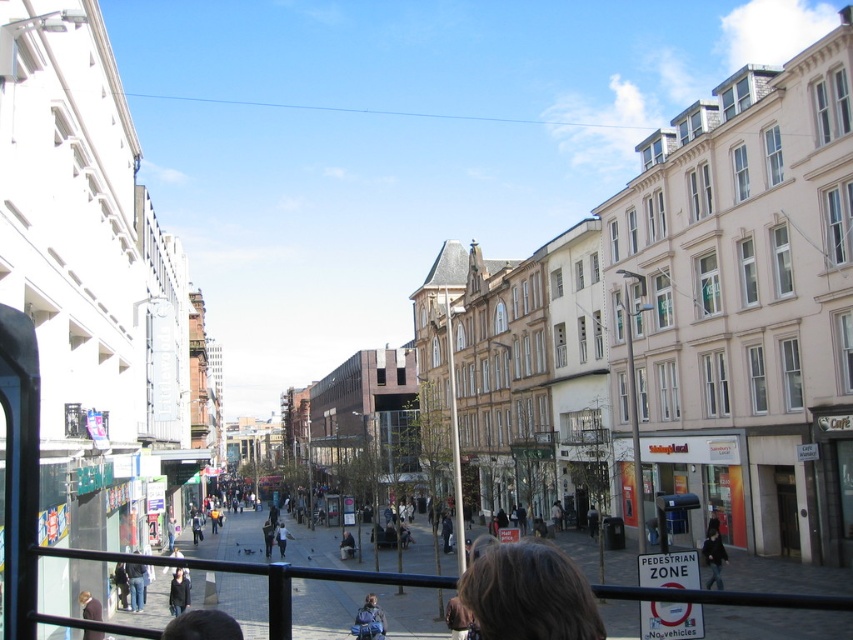
You are standing at the center of the bustling urban street scene. You see a dark brown hair at lower center located at point (527, 593). Is there any object at that point?

Yes, at point (527, 593) lies dark brown hair at lower center.

You are standing at the Pedestrian Zone sign and want to reach a destination located at point [171,582]. There is an obstacle at point [560,609]. Which point should you avoid to reach your destination safely?

You should avoid point [560,609] because it is in front of point [171,582], meaning it blocks the path to your destination.

You are standing at the camera position and want to take a photo of the dark brown hair at lower center. Considering the camera has a maximum focus range of 30 meters, will you be able to capture it clearly?

The dark brown hair at lower center is 28.39 meters away from the camera, which is within the maximum focus range of 30 meters. Therefore, you can capture it clearly.